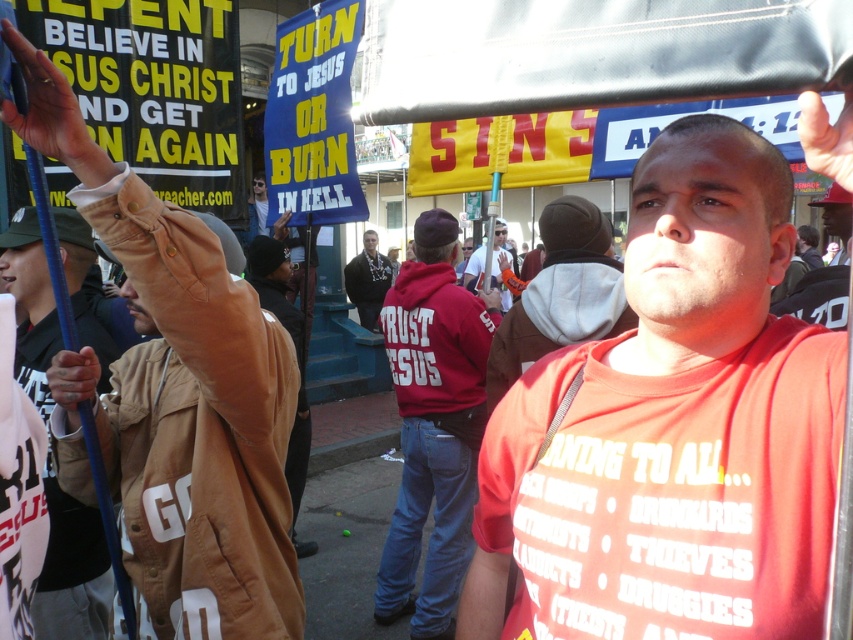
Can you confirm if red cotton hoodie at center is taller than dark gray hoodie at center?

Yes.

Who is more distant from viewer, (392, 552) or (360, 260)?

The point (360, 260) is more distant.

The image size is (853, 640). Identify the location of red cotton hoodie at center. (433, 426).

Who is more forward, (282, 272) or (258, 204)?

Point (282, 272) is more forward.

Is point (265, 260) positioned before point (256, 192)?

Yes, it is in front of point (256, 192).

The image size is (853, 640). Identify the location of brown suede jacket at center. (296, 358).

Can you confirm if dark gray hoodie at center is taller than matte black sunglasses at upper left?

Indeed, dark gray hoodie at center has a greater height compared to matte black sunglasses at upper left.

Does point (384, 276) lie behind point (254, 195)?

Yes, it is.

Does point (364, 230) come behind point (254, 230)?

That is True.

You are a GUI agent. You are given a task and a screenshot of the screen. Output one action in this format:
    pyautogui.click(x=<x>, y=<y>)
    Task: Click on the dark gray hoodie at center
    
    Given the screenshot: What is the action you would take?
    pyautogui.click(x=367, y=280)